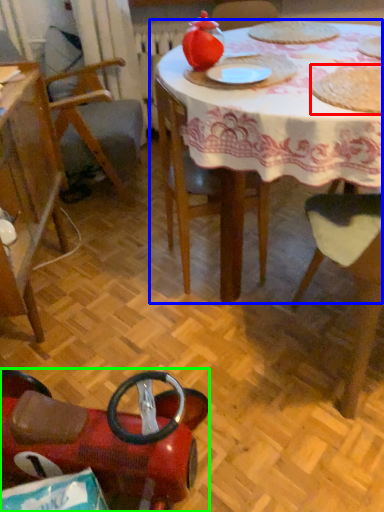
Question: Which object is the farthest from food (highlighted by a red box)? Choose among these: table (highlighted by a blue box) or chair (highlighted by a green box).

Choices:
 (A) table
 (B) chair

Answer: (B)